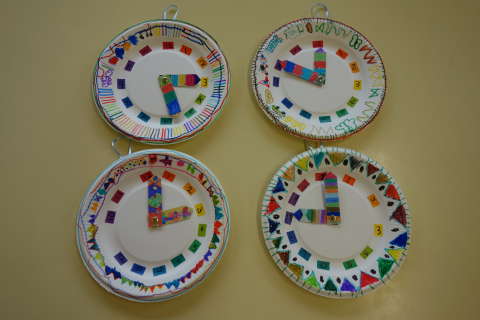
Locate an element on the screen. The height and width of the screenshot is (320, 480). clock 3 is located at coordinates (154, 250).